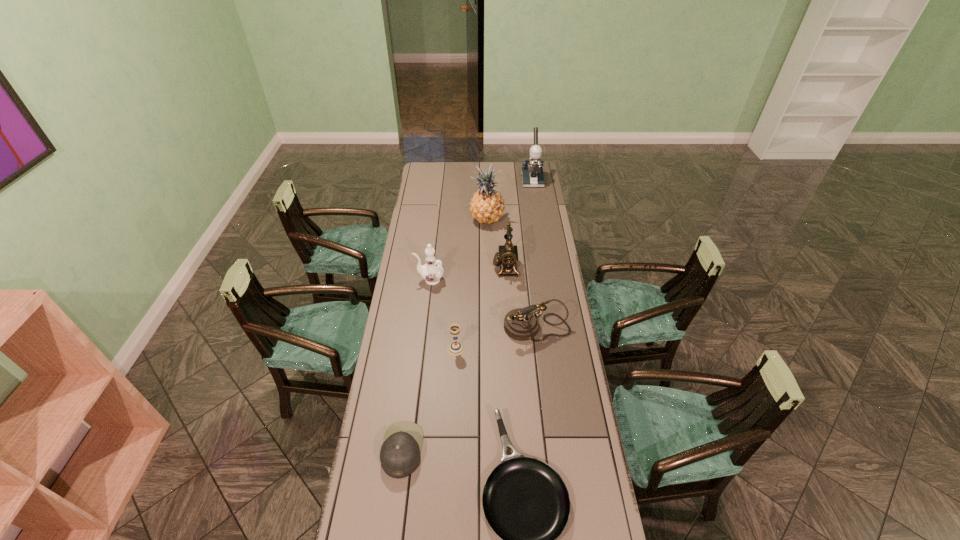
What are the coordinates of `unoccupied area between the nearer telephone and the cap` in the screenshot? It's located at (469, 389).

Where is `empty space that is in between the seventh tallest object and the farther telephone`? The height and width of the screenshot is (540, 960). empty space that is in between the seventh tallest object and the farther telephone is located at coordinates (454, 359).

What are the coordinates of `free space between the pineapple and the chinaware` in the screenshot? It's located at (459, 249).

The image size is (960, 540). What are the coordinates of `empty space between the chinaware and the chalice` in the screenshot? It's located at (443, 314).

Identify which object is the nearest to the shortest object. Please provide its 2D coordinates. Your answer should be formatted as a tuple, i.e. [(x, y)], where the tuple contains the x and y coordinates of a point satisfying the conditions above.

[(400, 453)]

Identify the location of the fourth closest object to the shorter telephone. This screenshot has width=960, height=540. (526, 503).

Locate an element on the screen. free region that satisfies the following two spatial constraints: 1. on the back side of the shorter telephone; 2. on the left side of the sixth tallest object is located at coordinates (457, 328).

The width and height of the screenshot is (960, 540). In order to click on vacant point that satisfies the following two spatial constraints: 1. at the spout of the sixth object from right to left; 2. on the right side of the chinaware in this screenshot , I will do `click(421, 349)`.

Find the location of a particular element. The width and height of the screenshot is (960, 540). free space that satisfies the following two spatial constraints: 1. on the rotary dial of the shorter telephone; 2. on the left side of the farther telephone is located at coordinates (510, 328).